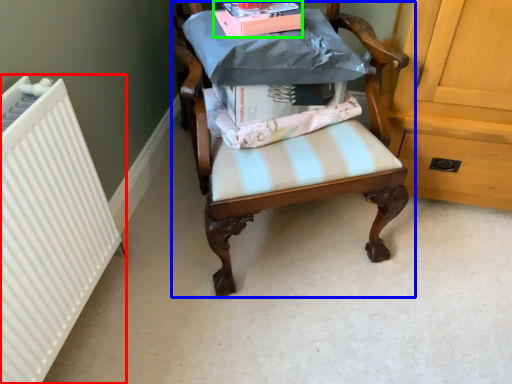
Question: Based on their relative distances, which object is farther from radiator (highlighted by a red box)? Choose from chair (highlighted by a blue box) and book (highlighted by a green box).

Choices:
 (A) chair
 (B) book

Answer: (B)